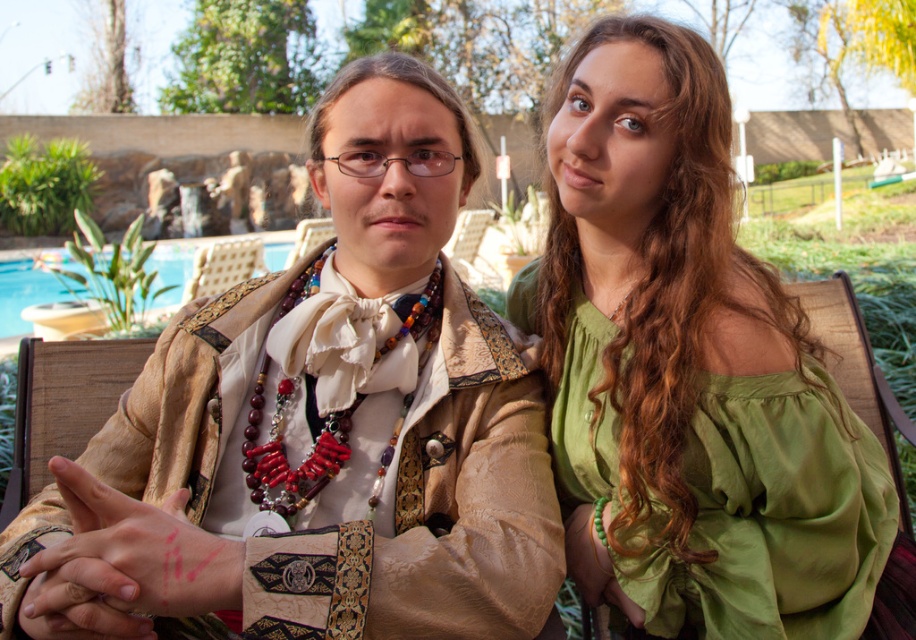
Is green silk blouse at upper right shorter than green beaded bracelet at lower right?

No.

Locate an element on the screen. green silk blouse at upper right is located at coordinates (695, 369).

The image size is (916, 640). In order to click on green silk blouse at upper right in this screenshot , I will do `click(695, 369)`.

Can you confirm if blue glass pool at left is taller than green beaded bracelet at lower right?

Yes.

Based on the photo, is blue glass pool at left below green beaded bracelet at lower right?

Actually, blue glass pool at left is above green beaded bracelet at lower right.

The width and height of the screenshot is (916, 640). I want to click on blue glass pool at left, so (x=24, y=292).

Can you confirm if matte gold jacket at center is positioned below blue glass pool at left?

Yes, matte gold jacket at center is below blue glass pool at left.

Does matte gold jacket at center have a lesser width compared to blue glass pool at left?

Yes.

Between point (301, 308) and point (49, 288), which one is positioned in front?

Point (301, 308) is more forward.

Where is `matte gold jacket at center`? This screenshot has height=640, width=916. matte gold jacket at center is located at coordinates (318, 428).